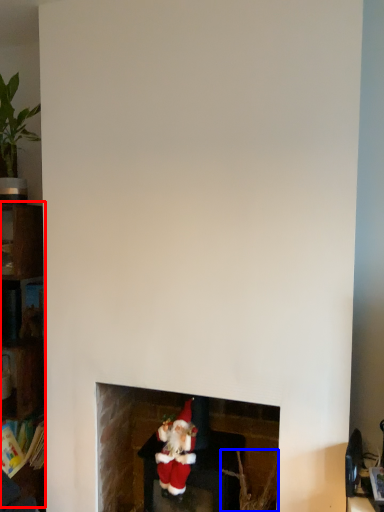
Question: Which of the following is the farthest to the observer, shelf (highlighted by a red box) or plant (highlighted by a blue box)?

Choices:
 (A) shelf
 (B) plant

Answer: (A)